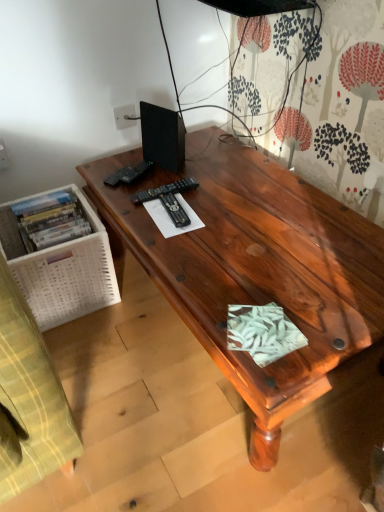
In order to click on vacant area that lies between black matte speaker at upper left and black plastic remote control at upper left, marked as the third remote control in a front-to-back arrangement in this screenshot , I will do `click(155, 174)`.